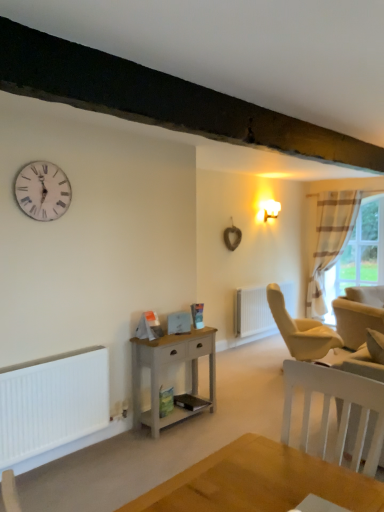
The image size is (384, 512). In order to click on free space in front of white matte heater at lower left in this screenshot , I will do `click(66, 482)`.